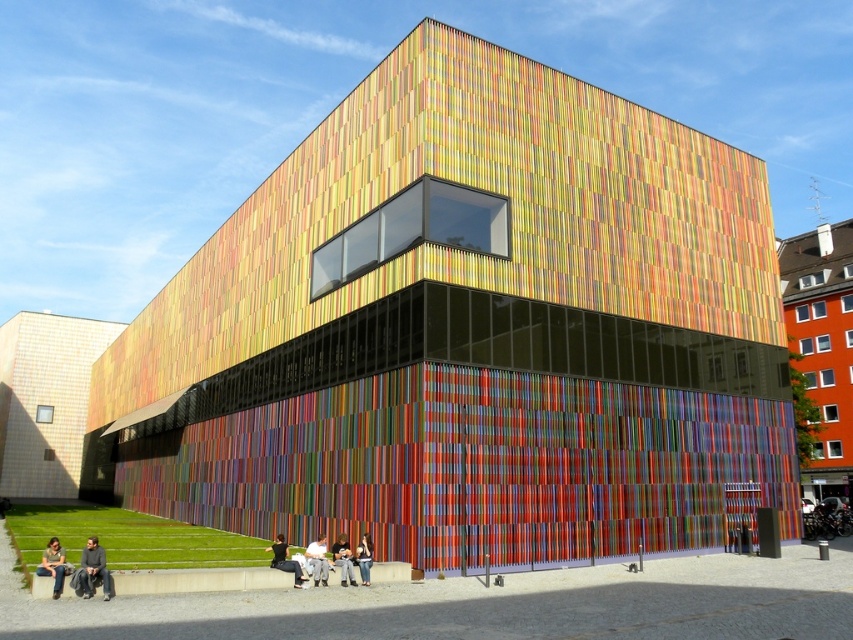
Question: Can you confirm if denim jacket at lower center is thinner than denim pants at lower center?

Choices:
 (A) yes
 (B) no

Answer: (B)

Question: Is multicolored wood paneling at lower left bigger than dark gray fabric jacket at lower left?

Choices:
 (A) yes
 (B) no

Answer: (A)

Question: Considering the real-world distances, which object is closest to the black fabric jacket at lower center?

Choices:
 (A) orange matte building at right
 (B) multicolored wood paneling at lower left
 (C) denim jacket at lower left

Answer: (C)

Question: Is denim jacket at lower center further to the viewer compared to denim pants at lower center?

Choices:
 (A) no
 (B) yes

Answer: (A)

Question: Which of the following is the farthest from the observer?

Choices:
 (A) denim jacket at lower center
 (B) dark gray fabric jacket at lower left
 (C) light gray fabric pants at lower center

Answer: (A)

Question: Which point is closer to the camera?

Choices:
 (A) dark gray fabric jacket at lower left
 (B) orange matte building at right
 (C) denim jacket at lower left
 (D) light gray fabric pants at lower center

Answer: (C)